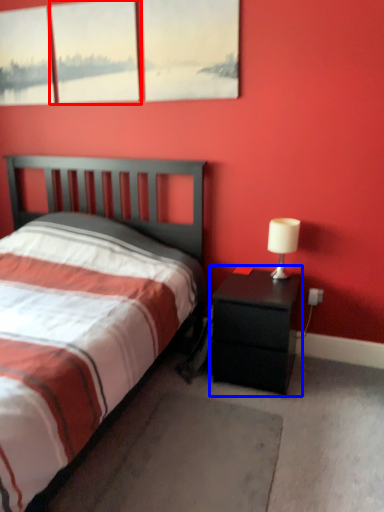
Question: Among these objects, which one is farthest to the camera, window (highlighted by a red box) or nightstand (highlighted by a blue box)?

Choices:
 (A) window
 (B) nightstand

Answer: (A)